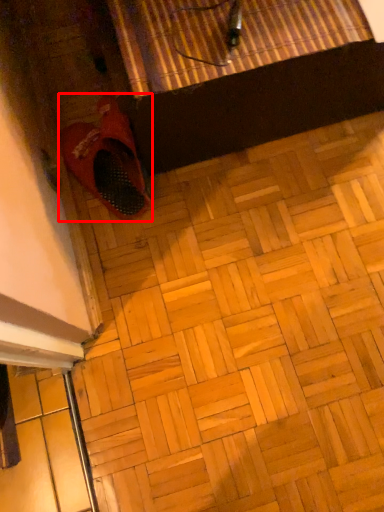
Question: From the image's perspective, where is footwear (annotated by the red box) located in relation to tile in the image?

Choices:
 (A) below
 (B) above

Answer: (B)